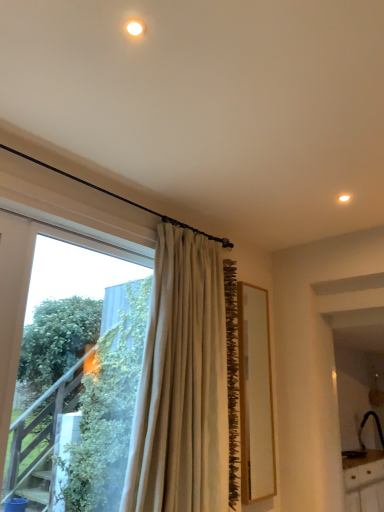
Question: Would you say black matte sink at lower right is inside or outside beige fabric curtain at center?

Choices:
 (A) inside
 (B) outside

Answer: (B)

Question: Considering the relative positions of black matte sink at lower right and beige fabric curtain at center in the image provided, is black matte sink at lower right to the left or to the right of beige fabric curtain at center?

Choices:
 (A) left
 (B) right

Answer: (B)

Question: Which object is the closest to the transparent glass window at left?

Choices:
 (A) beige fabric curtain at center
 (B) black matte sink at lower right

Answer: (A)

Question: Based on their relative distances, which object is farther from the beige fabric curtain at center?

Choices:
 (A) transparent glass window at left
 (B) black matte sink at lower right

Answer: (B)